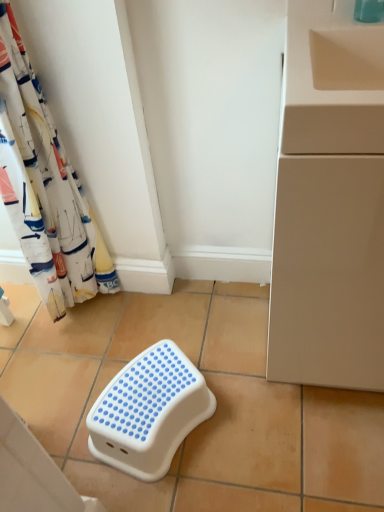
Where is `free space above white plastic step stool at center, the first ceramic tile viewed from the right (from a real-world perspective)`? This screenshot has height=512, width=384. free space above white plastic step stool at center, the first ceramic tile viewed from the right (from a real-world perspective) is located at coordinates (199, 372).